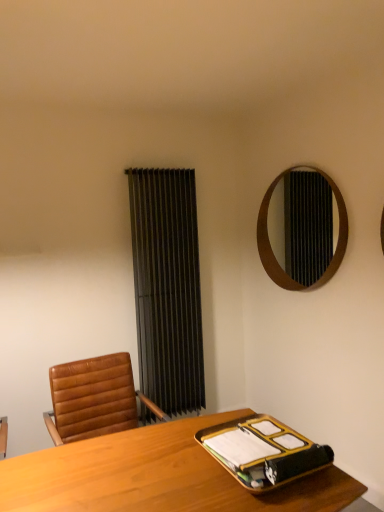
Question: Is light wood desk at center taller than black fabric curtain at center?

Choices:
 (A) yes
 (B) no

Answer: (B)

Question: Is light wood desk at center completely or partially outside of black fabric curtain at center?

Choices:
 (A) no
 (B) yes

Answer: (B)

Question: Considering the relative sizes of light wood desk at center and black fabric curtain at center in the image provided, is light wood desk at center thinner than black fabric curtain at center?

Choices:
 (A) no
 (B) yes

Answer: (A)

Question: Can you confirm if light wood desk at center is positioned to the left of black fabric curtain at center?

Choices:
 (A) yes
 (B) no

Answer: (B)

Question: Does light wood desk at center have a lesser height compared to black fabric curtain at center?

Choices:
 (A) no
 (B) yes

Answer: (B)

Question: Is light wood desk at center looking in the opposite direction of black fabric curtain at center?

Choices:
 (A) no
 (B) yes

Answer: (A)

Question: Is gold metallic binder at lower right to the left of wooden mirror at upper right from the viewer's perspective?

Choices:
 (A) yes
 (B) no

Answer: (A)

Question: Is gold metallic binder at lower right not near wooden mirror at upper right?

Choices:
 (A) no
 (B) yes

Answer: (B)

Question: From the image's perspective, is gold metallic binder at lower right under wooden mirror at upper right?

Choices:
 (A) no
 (B) yes

Answer: (B)

Question: Can you confirm if gold metallic binder at lower right is wider than wooden mirror at upper right?

Choices:
 (A) no
 (B) yes

Answer: (B)

Question: From the image's perspective, is gold metallic binder at lower right on wooden mirror at upper right?

Choices:
 (A) yes
 (B) no

Answer: (B)

Question: Can you confirm if gold metallic binder at lower right is smaller than wooden mirror at upper right?

Choices:
 (A) yes
 (B) no

Answer: (A)

Question: Considering the relative sizes of light wood desk at center and gold metallic binder at lower right in the image provided, is light wood desk at center smaller than gold metallic binder at lower right?

Choices:
 (A) no
 (B) yes

Answer: (A)